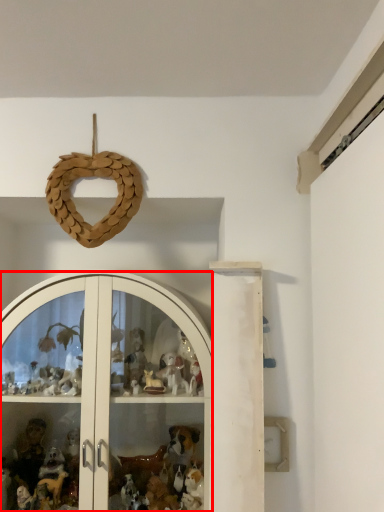
Question: From the image's perspective, where is glass door (annotated by the red box) located relative to toy?

Choices:
 (A) above
 (B) below

Answer: (B)